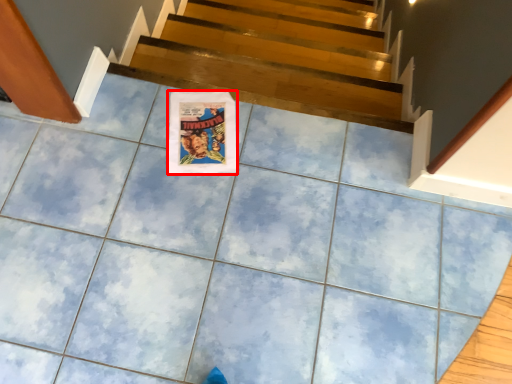
Question: Where is poster page (annotated by the red box) located in relation to stairs in the image?

Choices:
 (A) left
 (B) right

Answer: (A)